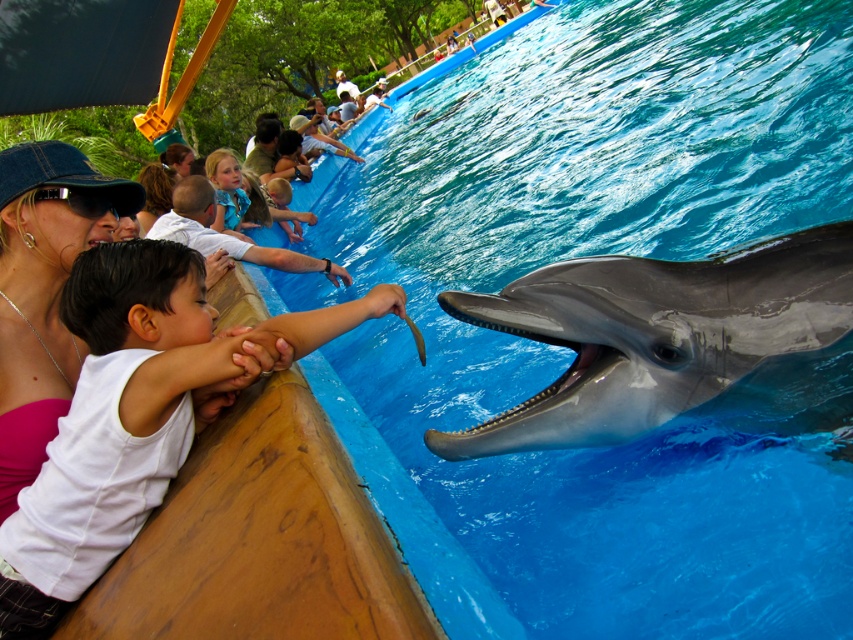
Question: Is smooth gray dolphin at center below blue satin dress at upper center?

Choices:
 (A) no
 (B) yes

Answer: (B)

Question: Which point appears closest to the camera in this image?

Choices:
 (A) (778, 342)
 (B) (138, 374)
 (C) (218, 225)
 (D) (460, 340)

Answer: (B)

Question: Which of the following is the farthest from the observer?

Choices:
 (A) blue satin dress at upper center
 (B) pink fabric at upper left
 (C) white matte shirt at left
 (D) white matte shirt at upper center

Answer: (A)

Question: Based on their relative distances, which object is farther from the smooth gray dolphin at center?

Choices:
 (A) blue smooth water at upper center
 (B) white matte shirt at left

Answer: (A)

Question: Is blue smooth water at upper center below blue satin dress at upper center?

Choices:
 (A) yes
 (B) no

Answer: (B)

Question: Can you confirm if white matte shirt at upper center is smaller than blue satin dress at upper center?

Choices:
 (A) no
 (B) yes

Answer: (B)